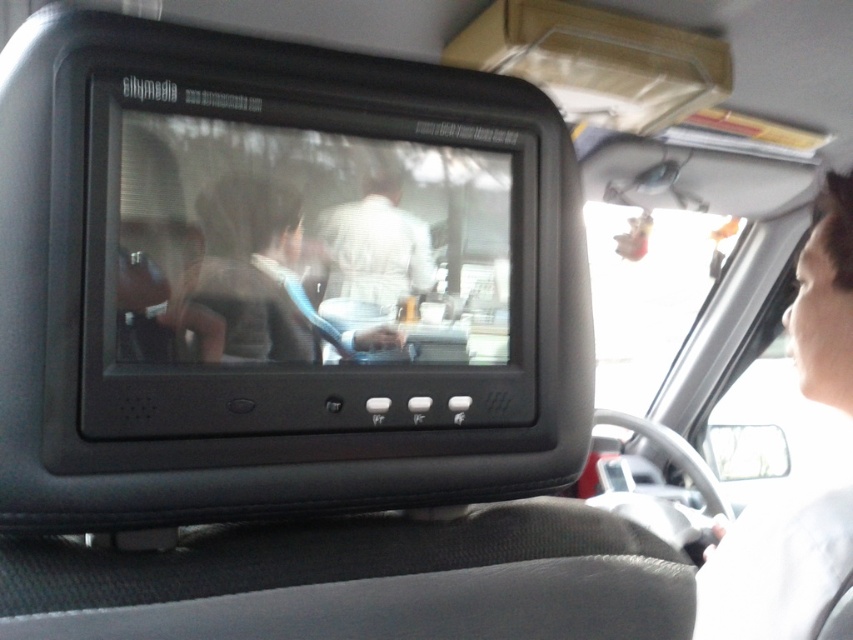
Question: Considering the relative positions of matte black monitor at center and light brown hair at upper right in the image provided, where is matte black monitor at center located with respect to light brown hair at upper right?

Choices:
 (A) below
 (B) above

Answer: (B)

Question: Which of the following is the farthest from the observer?

Choices:
 (A) matte black monitor at center
 (B) light brown hair at upper right

Answer: (B)

Question: Can you confirm if matte black monitor at center is positioned above light brown hair at upper right?

Choices:
 (A) no
 (B) yes

Answer: (B)

Question: Which point is closer to the camera?

Choices:
 (A) light brown hair at upper right
 (B) matte black monitor at center

Answer: (B)

Question: Does matte black monitor at center come behind light brown hair at upper right?

Choices:
 (A) no
 (B) yes

Answer: (A)